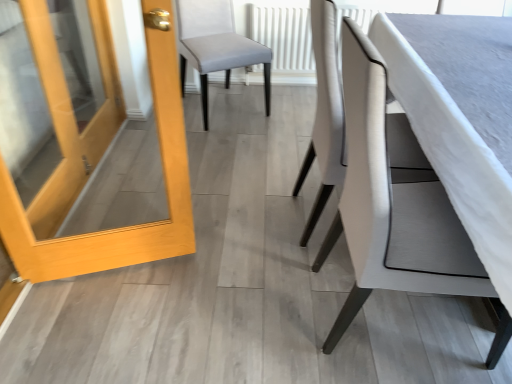
Question: Considering the positions of white fabric chair at center, the second chair from the front, and white textured radiator at center in the image, is white fabric chair at center, the second chair from the front, bigger or smaller than white textured radiator at center?

Choices:
 (A) big
 (B) small

Answer: (A)

Question: Considering their positions, is white fabric chair at center, which is counted as the 2th chair, starting from the back, located in front of or behind white textured radiator at center?

Choices:
 (A) behind
 (B) front

Answer: (B)

Question: Which of these objects is positioned farthest from the white fabric chair at center, positioned as the 3th chair in back-to-front order?

Choices:
 (A) white textured radiator at center
 (B) white fabric chair at center, which is counted as the 2th chair, starting from the back
 (C) light wood/matte door at left
 (D) light gray fabric chair at center, which ranks as the first chair in back-to-front order

Answer: (A)

Question: Considering the real-world distances, which object is closest to the white fabric chair at center, which is counted as the 2th chair, starting from the back?

Choices:
 (A) white fabric chair at center, which is the first chair in front-to-back order
 (B) light wood/matte door at left
 (C) white textured radiator at center
 (D) light gray fabric chair at center, the 3th chair from the front

Answer: (A)